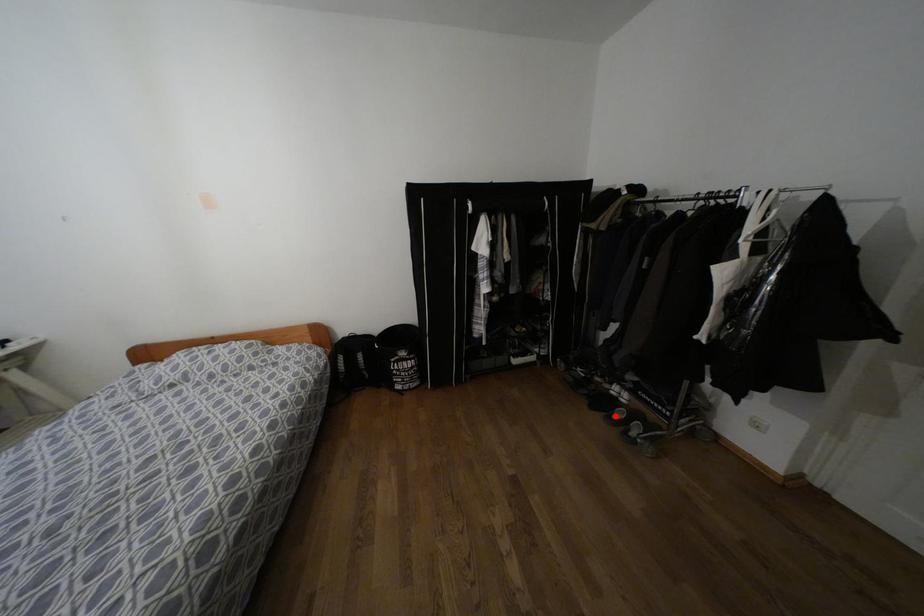
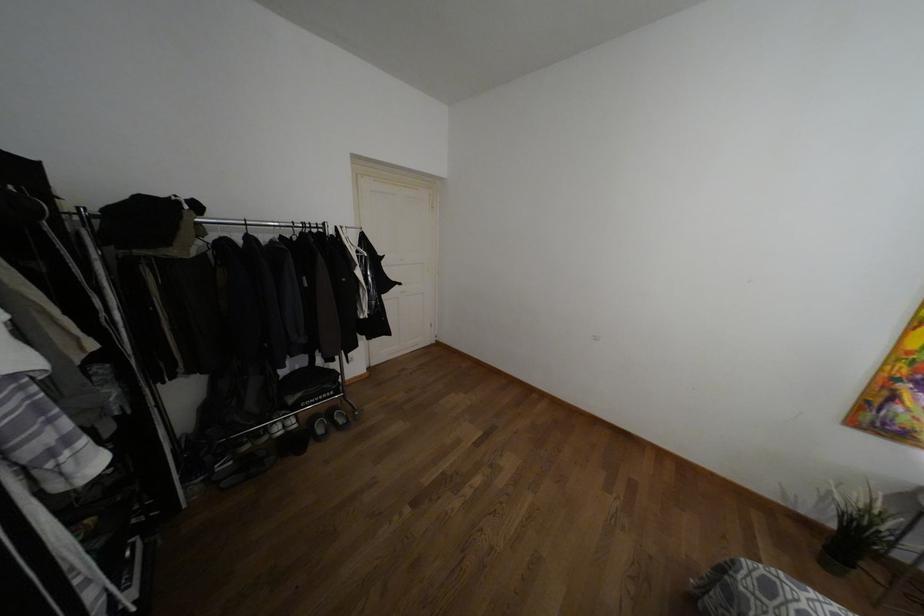
Question: I am providing you with two images of the same scene from different viewpoints. In image1, a red point is highlighted. Considering the same 3D point in image2, which of the following is correct?

Choices:
 (A) It is closer
 (B) It is farther

Answer: (B)